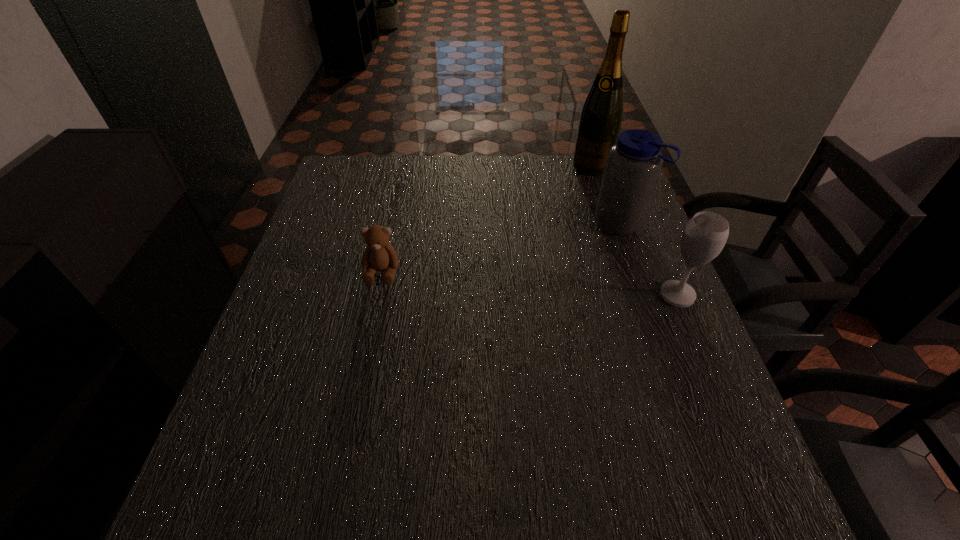
The image size is (960, 540). In the image, there is a desktop. In order to click on vacant region at the near edge in this screenshot , I will do `click(382, 443)`.

This screenshot has width=960, height=540. I want to click on blank space at the left edge, so click(x=366, y=226).

At what (x,y) coordinates should I click in order to perform the action: click on free space at the right edge of the desktop. Please return your answer as a coordinate pair (x, y). The height and width of the screenshot is (540, 960). Looking at the image, I should click on (589, 211).

Where is `free space at the far left corner of the desktop`? The height and width of the screenshot is (540, 960). free space at the far left corner of the desktop is located at coordinates (345, 176).

This screenshot has height=540, width=960. In the image, there is a desktop. Identify the location of free region at the near left corner. (256, 418).

Find the location of a particular element. The width and height of the screenshot is (960, 540). blank space at the near right corner of the desktop is located at coordinates (707, 423).

This screenshot has width=960, height=540. Identify the location of free area in between the wineglass and the water bottle. (649, 258).

Where is `vacant area between the shortest object and the wineglass`? The width and height of the screenshot is (960, 540). vacant area between the shortest object and the wineglass is located at coordinates (530, 284).

Locate an element on the screen. This screenshot has width=960, height=540. vacant area that lies between the teddy bear and the wineglass is located at coordinates (530, 284).

Find the location of a particular element. This screenshot has width=960, height=540. vacant space that's between the third nearest object and the teddy bear is located at coordinates (501, 247).